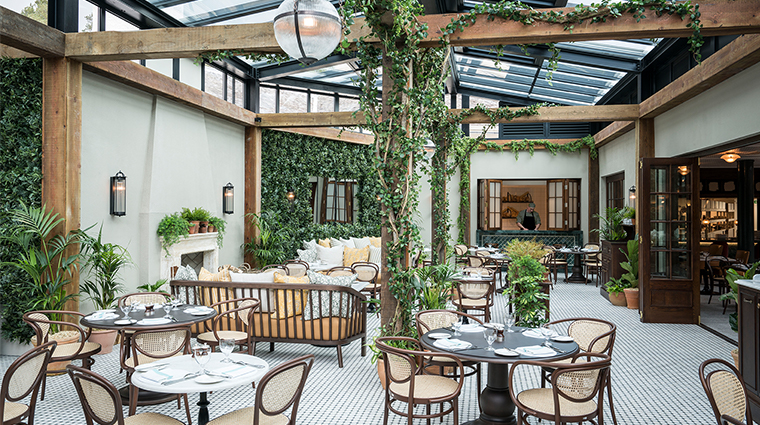
This screenshot has width=760, height=425. I want to click on glass, so click(x=593, y=87).